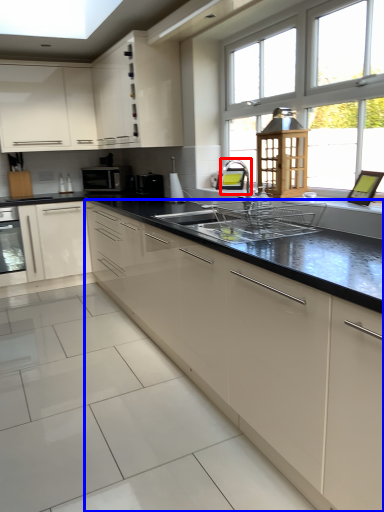
Question: Which object is further to the camera taking this photo, faucet (highlighted by a red box) or cabinetry (highlighted by a blue box)?

Choices:
 (A) faucet
 (B) cabinetry

Answer: (A)